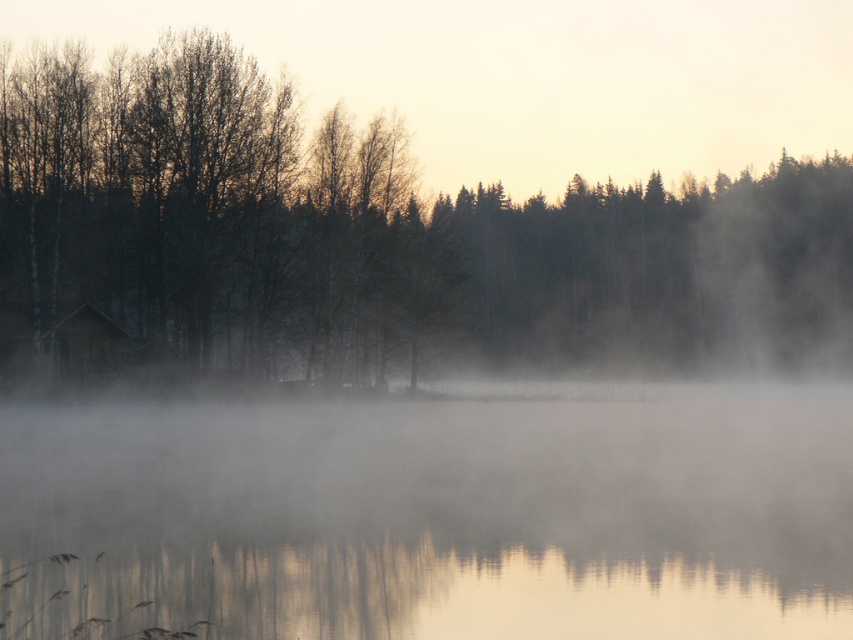
Question: Is transparent misty water at center positioned before silhouette bark tree at left?

Choices:
 (A) yes
 (B) no

Answer: (A)

Question: Observing the image, what is the correct spatial positioning of transparent misty water at center in reference to silhouette bark tree at left?

Choices:
 (A) below
 (B) above

Answer: (A)

Question: Is transparent misty water at center to the left of silhouette bark tree at left from the viewer's perspective?

Choices:
 (A) yes
 (B) no

Answer: (A)

Question: Which point is farther to the camera?

Choices:
 (A) (97, 300)
 (B) (693, 566)

Answer: (A)